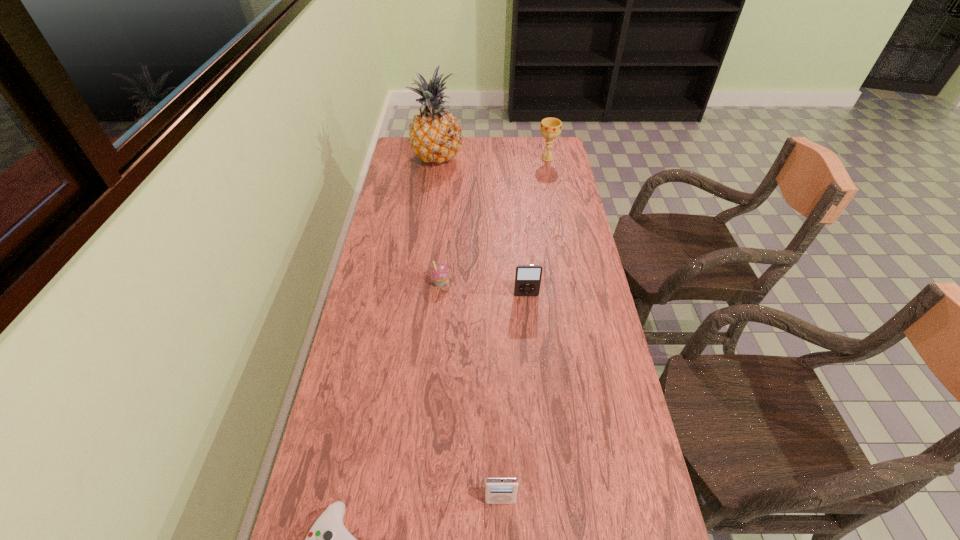
Find the location of a particular element. The image size is (960, 540). pineapple is located at coordinates (435, 135).

Identify the location of the rightmost object. The height and width of the screenshot is (540, 960). coord(550,128).

At what (x,y) coordinates should I click in order to perform the action: click on the second tallest object. Please return your answer as a coordinate pair (x, y). Looking at the image, I should click on pos(550,128).

What are the coordinates of `the farther iPod` in the screenshot? It's located at (527, 277).

The height and width of the screenshot is (540, 960). Find the location of `the fourth farthest object`. the fourth farthest object is located at coordinates [527, 277].

This screenshot has height=540, width=960. In order to click on the fourth object from left to right in this screenshot , I will do `click(498, 490)`.

Identify the location of the left iPod. (498, 490).

Locate an element on the screen. The image size is (960, 540). cupcake is located at coordinates (438, 273).

Find the location of `free space located on the right of the pineapple`. free space located on the right of the pineapple is located at coordinates (525, 159).

The height and width of the screenshot is (540, 960). What are the coordinates of `vacant region located on the left of the second tallest object` in the screenshot? It's located at (521, 158).